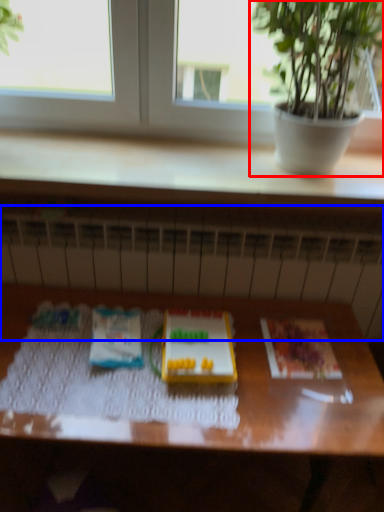
Question: Which of the following is the farthest to the observer, houseplant (highlighted by a red box) or radiator (highlighted by a blue box)?

Choices:
 (A) houseplant
 (B) radiator

Answer: (B)